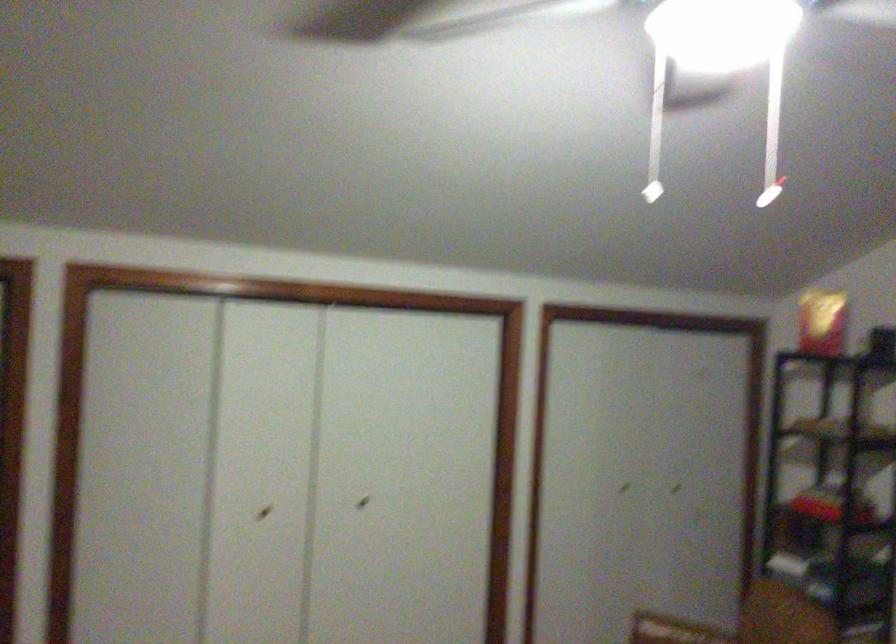
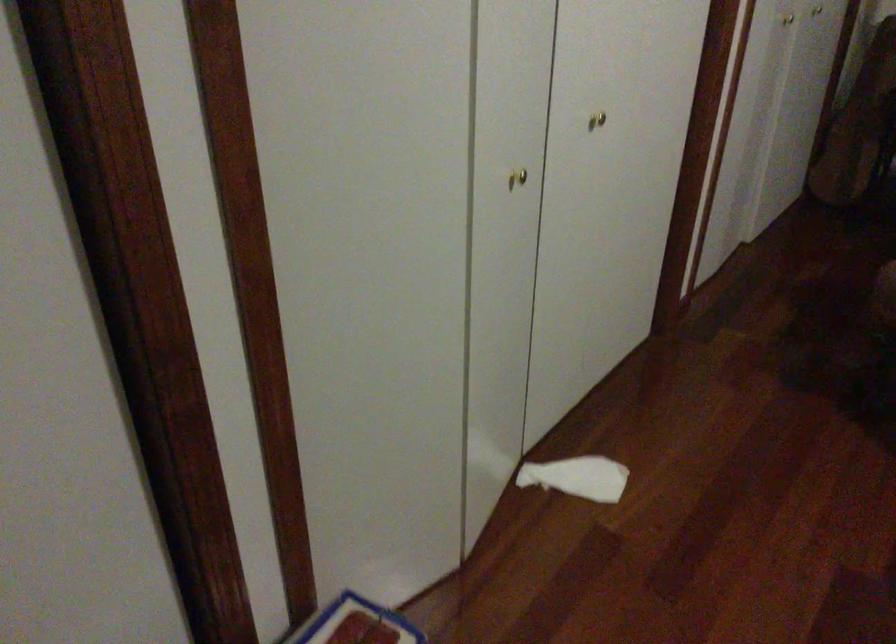
Where in the second image is the point corresponding to [366,511] from the first image?

(597, 120)